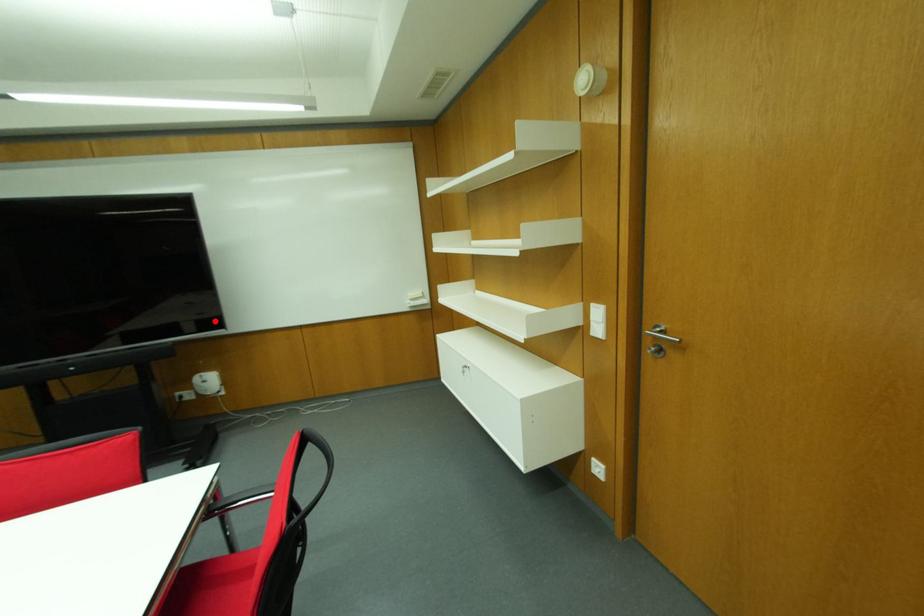
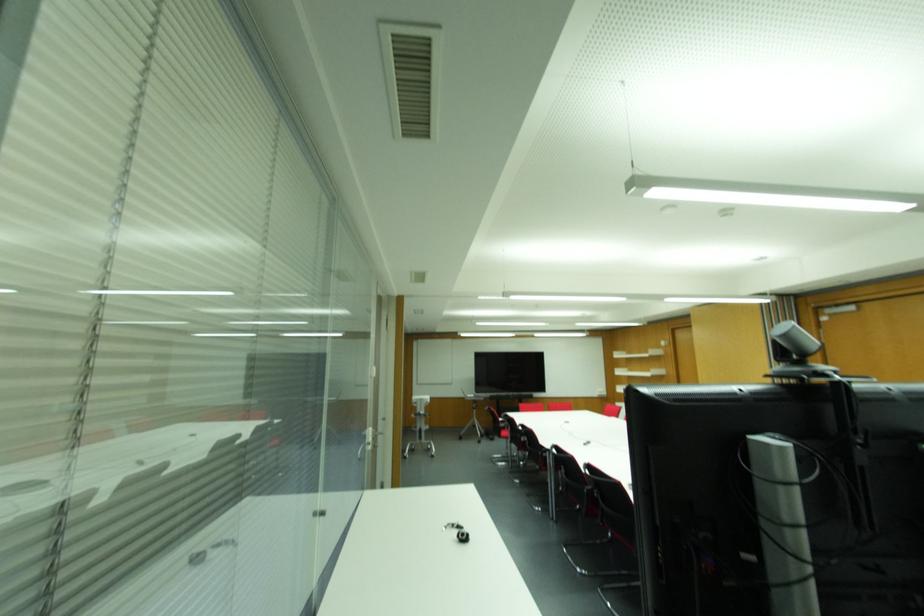
Question: I am providing you with two images of the same scene from different viewpoints. Given a red point in image1, look at the same physical point in image2. Is it:

Choices:
 (A) Closer to the viewpoint
 (B) Farther from the viewpoint

Answer: (B)